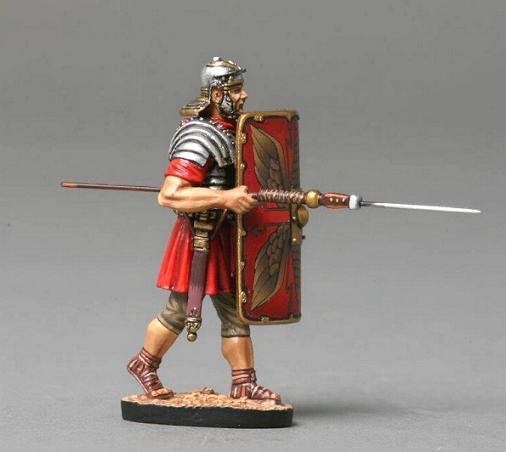
The image size is (506, 452). What are the coordinates of `roman soldier figurine` in the screenshot? It's located at (222, 152).